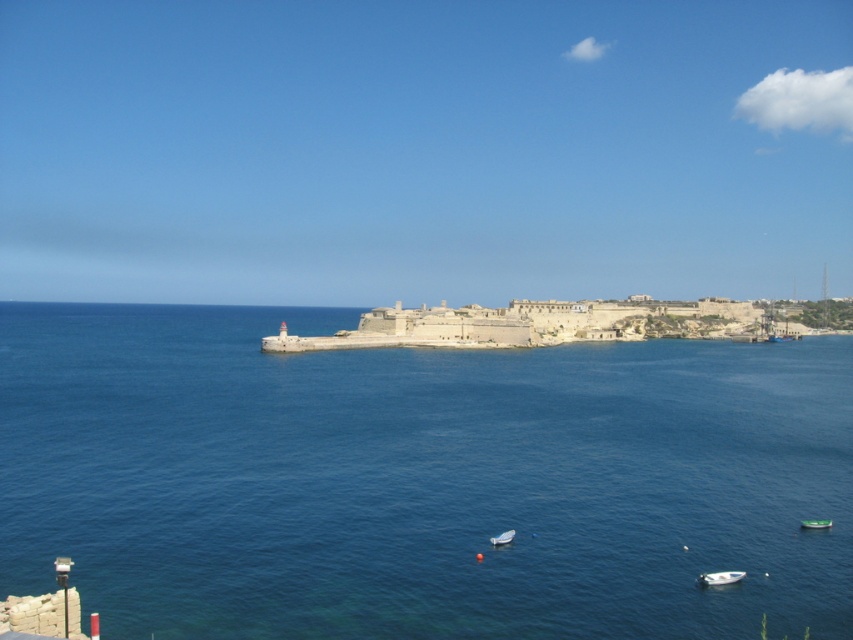
Question: From the image, what is the correct spatial relationship of white plastic boat at lower right in relation to white plastic boat at lower center?

Choices:
 (A) left
 (B) right

Answer: (B)

Question: Does blue water at center have a greater width compared to white plastic boat at lower right?

Choices:
 (A) no
 (B) yes

Answer: (B)

Question: Estimate the real-world distances between objects in this image. Which object is closer to the white plastic boat at lower right?

Choices:
 (A) blue water at center
 (B) green plastic boat at lower right

Answer: (B)

Question: Which point appears farthest from the camera in this image?

Choices:
 (A) (347, 416)
 (B) (811, 522)
 (C) (509, 532)

Answer: (A)

Question: Can you confirm if blue water at center is bigger than white plastic boat at lower right?

Choices:
 (A) yes
 (B) no

Answer: (A)

Question: Which of the following is the farthest from the observer?

Choices:
 (A) blue water at center
 (B) white plastic boat at lower right
 (C) white plastic boat at lower center

Answer: (C)